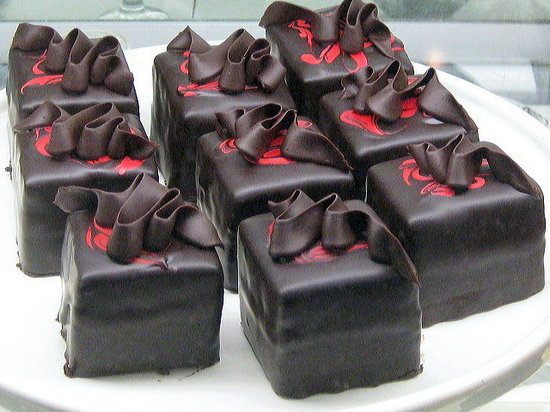
Locate an element on the screen. Image resolution: width=550 pixels, height=412 pixels. side of serving tray is located at coordinates (512, 379).